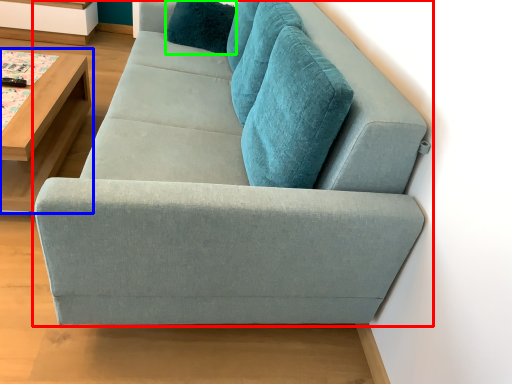
Question: Based on their relative distances, which object is nearer to studio couch (highlighted by a red box)? Choose from table (highlighted by a blue box) and pillow (highlighted by a green box).

Choices:
 (A) table
 (B) pillow

Answer: (A)